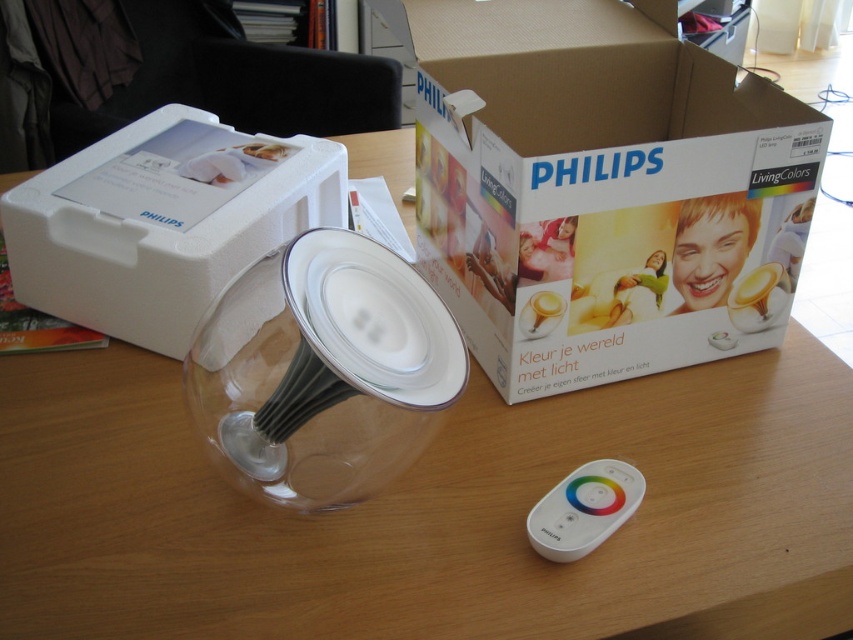
Is white cardboard box at center smaller than white plastic remote control at lower center?

No.

Is white cardboard box at center to the left of white plastic remote control at lower center from the viewer's perspective?

In fact, white cardboard box at center is to the right of white plastic remote control at lower center.

Who is more distant from viewer, (569, 93) or (572, 534)?

The point (569, 93) is behind.

Where is `white cardboard box at center`? white cardboard box at center is located at coordinates (601, 188).

Who is taller, white foam box at upper left or white plastic remote control at lower center?

With more height is white foam box at upper left.

Does point (76, 304) lie behind point (595, 474)?

Yes.

Locate an element on the screen. This screenshot has height=640, width=853. white foam box at upper left is located at coordinates (163, 221).

Between white cardboard box at center and white foam box at upper left, which one appears on the right side from the viewer's perspective?

From the viewer's perspective, white cardboard box at center appears more on the right side.

Between white cardboard box at center and white foam box at upper left, which one is positioned higher?

white cardboard box at center

Which is in front, point (495, 211) or point (286, 220)?

Positioned in front is point (495, 211).

Identify the location of white cardboard box at center. (601, 188).